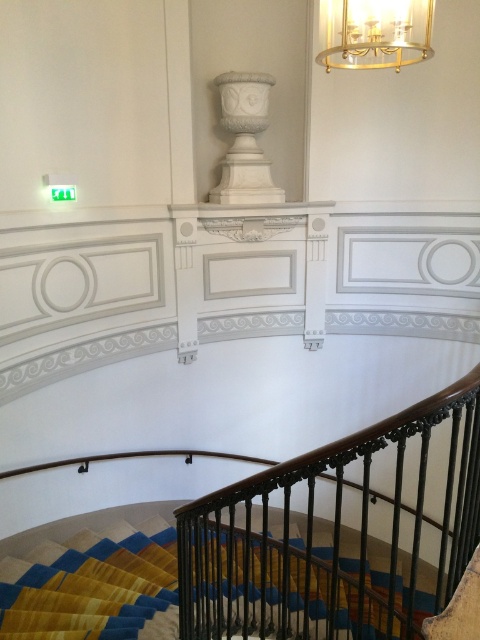
Question: In this image, where is multicolored carpeted stairs at lower center located relative to white marble urn at upper center?

Choices:
 (A) right
 (B) left

Answer: (B)

Question: Which object is the farthest from the gold metallic chandelier at upper center?

Choices:
 (A) white marble urn at upper center
 (B) black wrought iron railing at center

Answer: (B)

Question: Is black wrought iron railing at center thinner than white marble urn at upper center?

Choices:
 (A) no
 (B) yes

Answer: (A)

Question: Which point appears farthest from the camera in this image?

Choices:
 (A) (247, 170)
 (B) (124, 602)
 (C) (457, 477)

Answer: (A)

Question: Which point is closer to the camera taking this photo?

Choices:
 (A) (280, 193)
 (B) (324, 42)

Answer: (B)

Question: Does black wrought iron railing at center lie behind gold metallic chandelier at upper center?

Choices:
 (A) no
 (B) yes

Answer: (A)